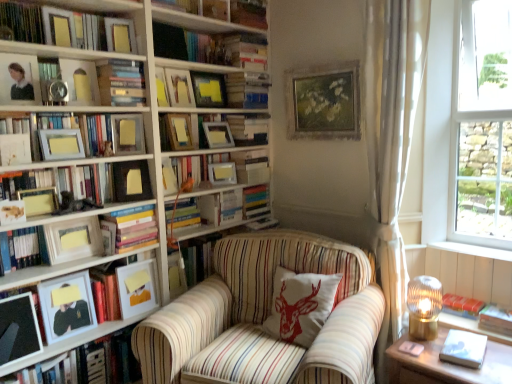
Identify the location of free space above white wood window sill at right (from a real-world perspective). Image resolution: width=512 pixels, height=384 pixels. pyautogui.click(x=467, y=246).